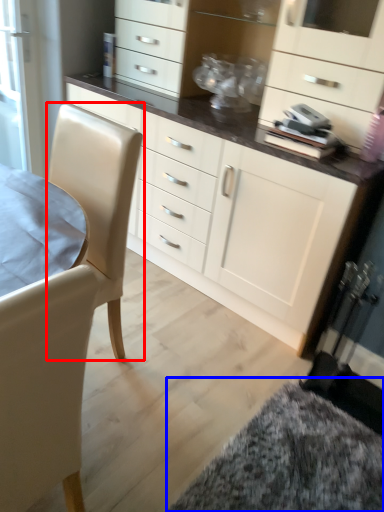
Question: Which object appears closest to the camera in this image, swivel chair (highlighted by a red box) or wide (highlighted by a blue box)?

Choices:
 (A) swivel chair
 (B) wide

Answer: (A)